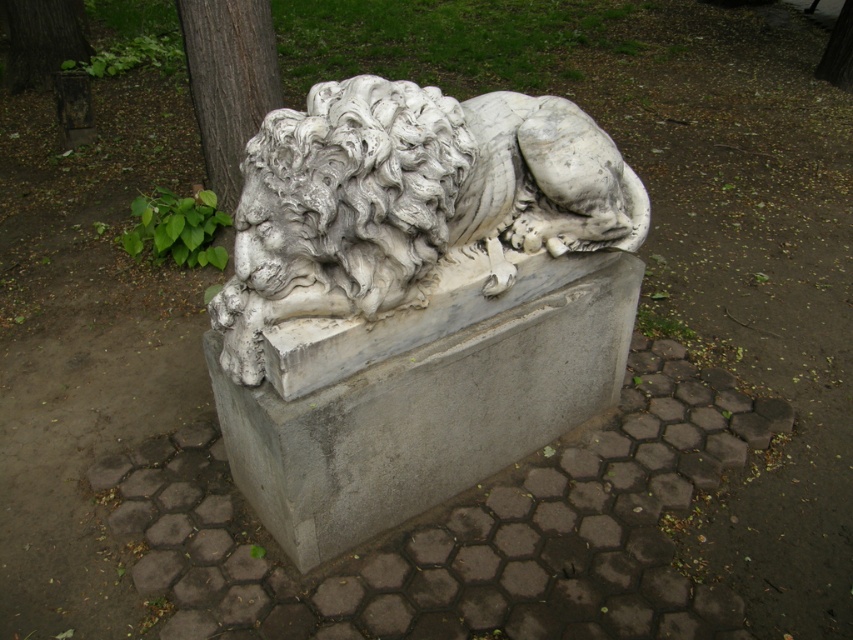
You are standing in front of a sculpture garden and see the white marble lion at center and the gray concrete at center. Which object is positioned to the right side?

The white marble lion at center is positioned to the right of the gray concrete at center.

You are an art curator planning to move the white marble lion at center and the smooth bark tree at upper left to a new exhibition space. The entrance of the new space has a doorway that is 1.5 meters wide. Based on their widths, can both objects fit through the doorway when moved individually?

The white marble lion at center is wider than the smooth bark tree at upper left. Since the doorway is 1.5 meters wide, the smooth bark tree at upper left may fit through, but the white marble lion at center might be too wide to pass through the doorway individually.

You are an architect designing a new public plaza and want to place a statue and a platform in the center. The statue must be shorter than the platform it sits on. Given the scene described, can the white marble lion at center be placed on the gray concrete at center without violating this requirement?

The white marble lion at center has a lesser height compared to gray concrete at center, so placing the white marble lion at center on the gray concrete at center would satisfy the requirement that the statue is shorter than its platform.